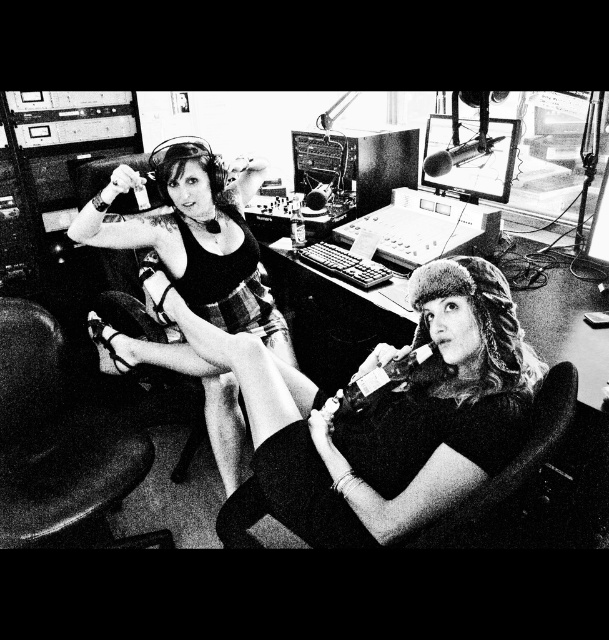
You are a photographer setting up a shoot in the studio. You need to place a large prop that requires 1.2 meters of space. You see the soft fur hat at center and the soft fabric chair at lower right. Which object can accommodate the prop without moving other items?

The soft fur hat at center is bigger than the soft fabric chair at lower right, but neither can accommodate a prop requiring 1.2 meters of space as their sizes are not specified in terms of meters. However, the soft fur hat at center might provide more space due to its larger size compared to the soft fabric chair at lower right.

Based on the scene description, which object corresponds to the coordinates point (195, 237)?

The coordinates point (195, 237) correspond to the matte black dress at left.

Looking at this image, you are a photographer setting up for a photoshoot in the studio. You need to ensure that the matte black dress at left and the metallic silver microphone at upper center are both visible in the frame. Based on their positions, which object is closer to the camera?

The matte black dress at left is in front of the metallic silver microphone at upper center, so it is closer to the camera.